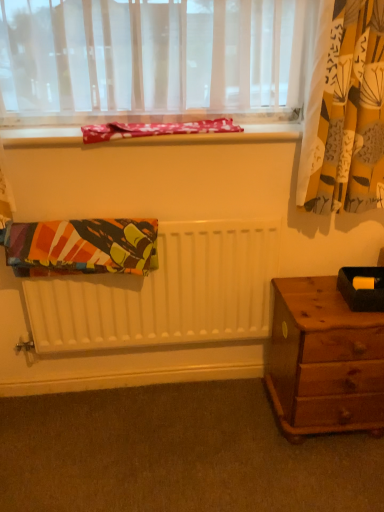
Where is `vacant area that is in front of wooden nightstand at lower right`? This screenshot has width=384, height=512. vacant area that is in front of wooden nightstand at lower right is located at coordinates (323, 474).